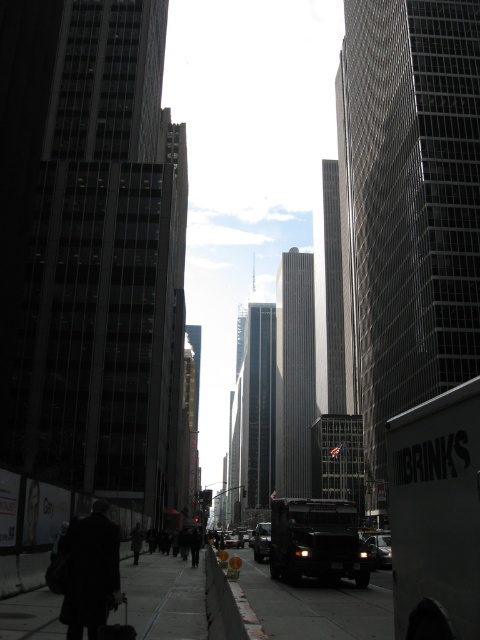
Question: Is gray concrete sidewalk at lower left to the left of dark asphalt pavement at lower center from the viewer's perspective?

Choices:
 (A) yes
 (B) no

Answer: (A)

Question: Is gray concrete sidewalk at lower left to the right of metallic silver car at center from the viewer's perspective?

Choices:
 (A) yes
 (B) no

Answer: (B)

Question: Can you confirm if gray concrete sidewalk at lower left is positioned below dark wool coat at lower left?

Choices:
 (A) no
 (B) yes

Answer: (B)

Question: Which point is closer to the camera?

Choices:
 (A) metallic silver car at center
 (B) gray concrete sidewalk at lower left

Answer: (B)

Question: Which object is closer to the camera taking this photo?

Choices:
 (A) dark gray coat at lower left
 (B) metallic silver truck at center
 (C) metallic silver car at lower right
 (D) gray concrete sidewalk at lower left

Answer: (D)

Question: Which object appears farthest from the camera in this image?

Choices:
 (A) dark asphalt pavement at lower center
 (B) metallic silver truck at center
 (C) dark wool coat at lower left
 (D) gray concrete sidewalk at lower left

Answer: (B)